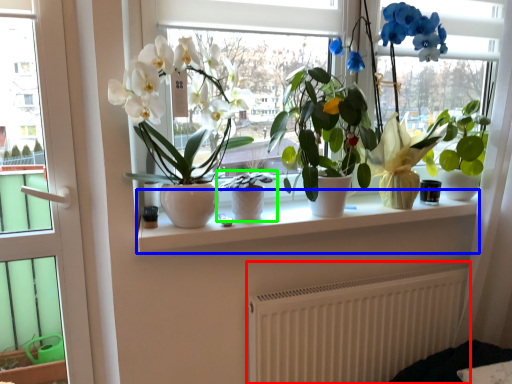
Question: Estimate the real-world distances between objects in this image. Which object is farther from radiator (highlighted by a red box), window sill (highlighted by a blue box) or houseplant (highlighted by a green box)?

Choices:
 (A) window sill
 (B) houseplant

Answer: (B)